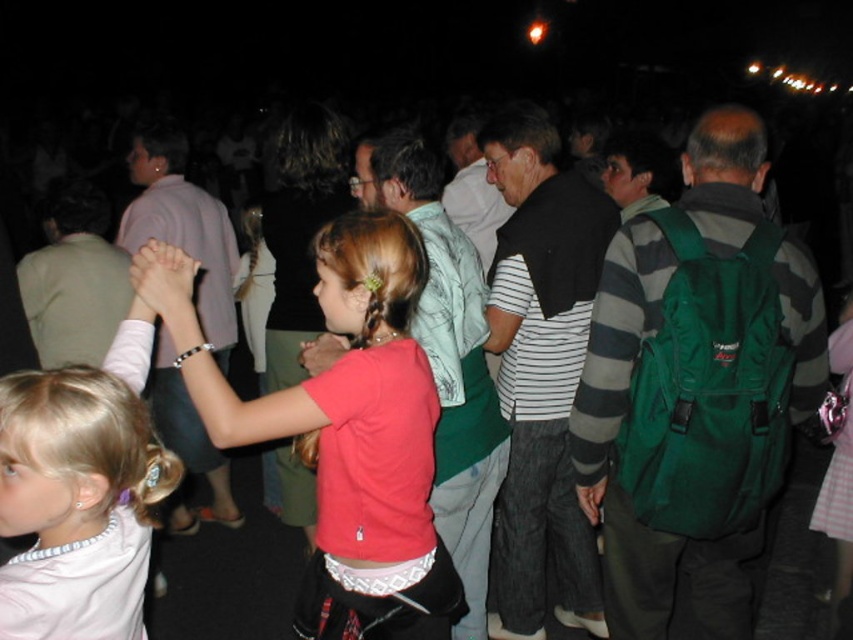
Does matte pink shirt at center have a smaller size compared to light pink fabric shirt at center?

Incorrect, matte pink shirt at center is not smaller in size than light pink fabric shirt at center.

In the scene shown: Can you confirm if matte pink shirt at center is thinner than light pink fabric shirt at center?

Incorrect, matte pink shirt at center's width is not less than light pink fabric shirt at center's.

Locate an element on the screen. The height and width of the screenshot is (640, 853). matte pink shirt at center is located at coordinates (345, 429).

Where is `matte pink shirt at center`? This screenshot has width=853, height=640. matte pink shirt at center is located at coordinates (345, 429).